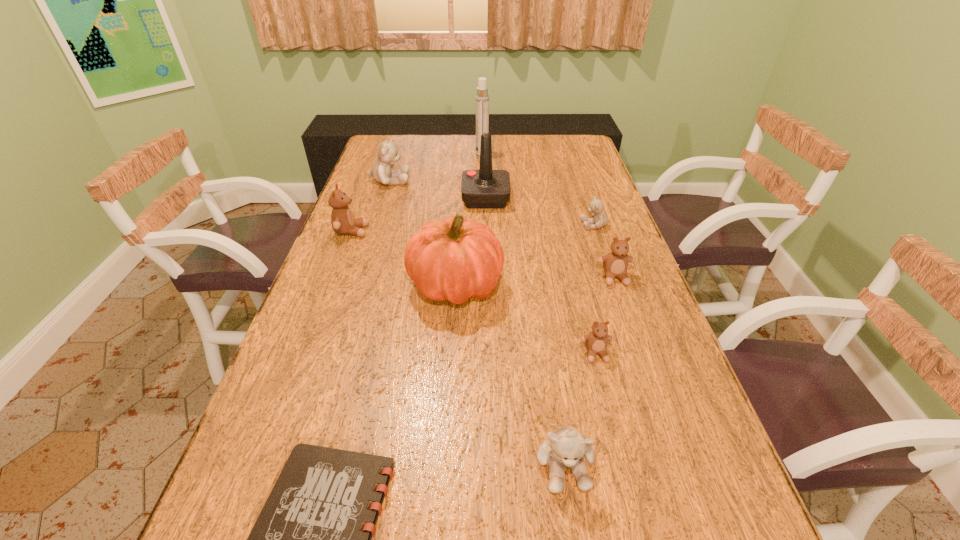
You are a GUI agent. You are given a task and a screenshot of the screen. Output one action in this format:
    pyautogui.click(x=<x>, y=<y>)
    Task: Click on the vacant space located 0.190m on the face of the biggest gray teddy bear
    The height and width of the screenshot is (540, 960).
    Given the screenshot: What is the action you would take?
    pyautogui.click(x=463, y=180)

You are a GUI agent. You are given a task and a screenshot of the screen. Output one action in this format:
    pyautogui.click(x=<x>, y=<y>)
    Task: Click on the vacant space situated 0.370m on the front-facing side of the second farthest brown teddy bear
    
    Given the screenshot: What is the action you would take?
    pyautogui.click(x=662, y=414)

The width and height of the screenshot is (960, 540). Find the location of `free region located 0.250m on the front-facing side of the second nearest teddy bear`. free region located 0.250m on the front-facing side of the second nearest teddy bear is located at coordinates (628, 478).

At what (x,y) coordinates should I click in order to perform the action: click on free space located on the face of the smallest gray teddy bear. Please return your answer as a coordinate pair (x, y). Looking at the image, I should click on (532, 225).

The image size is (960, 540). Find the location of `free space located on the face of the smallest gray teddy bear`. free space located on the face of the smallest gray teddy bear is located at coordinates (541, 225).

You are a GUI agent. You are given a task and a screenshot of the screen. Output one action in this format:
    pyautogui.click(x=<x>, y=<y>)
    Task: Click on the vacant region located on the face of the smallest gray teddy bear
    This screenshot has width=960, height=540.
    Given the screenshot: What is the action you would take?
    pyautogui.click(x=541, y=225)

What are the coordinates of `object that is at the far edge` in the screenshot? It's located at (482, 98).

Locate an element on the screen. The width and height of the screenshot is (960, 540). free space at the far edge of the desktop is located at coordinates (411, 159).

At what (x,y) coordinates should I click in order to perform the action: click on vacant position at the left edge of the desktop. Please return your answer as a coordinate pair (x, y). Looking at the image, I should click on (319, 274).

Identify the location of blank space at the right edge of the desktop. (670, 469).